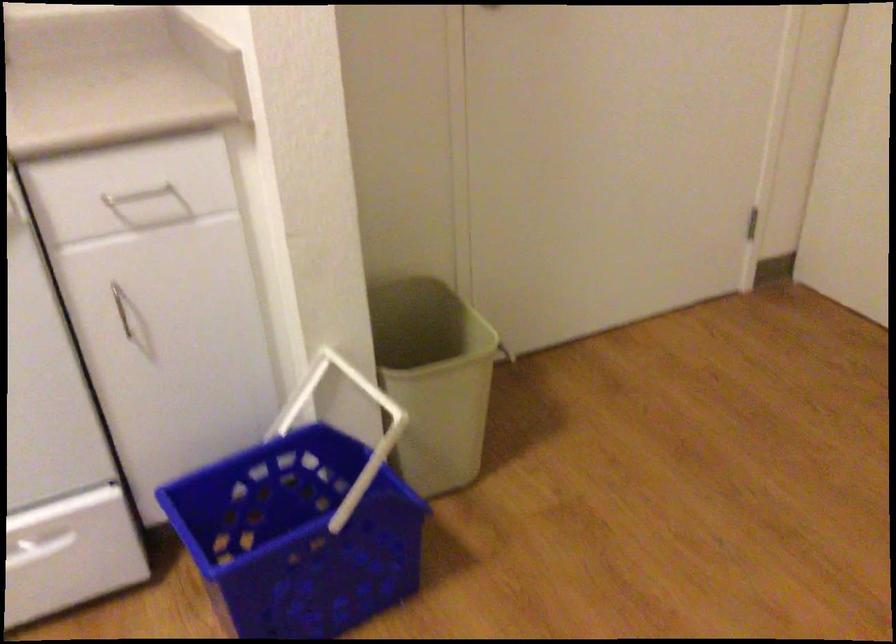
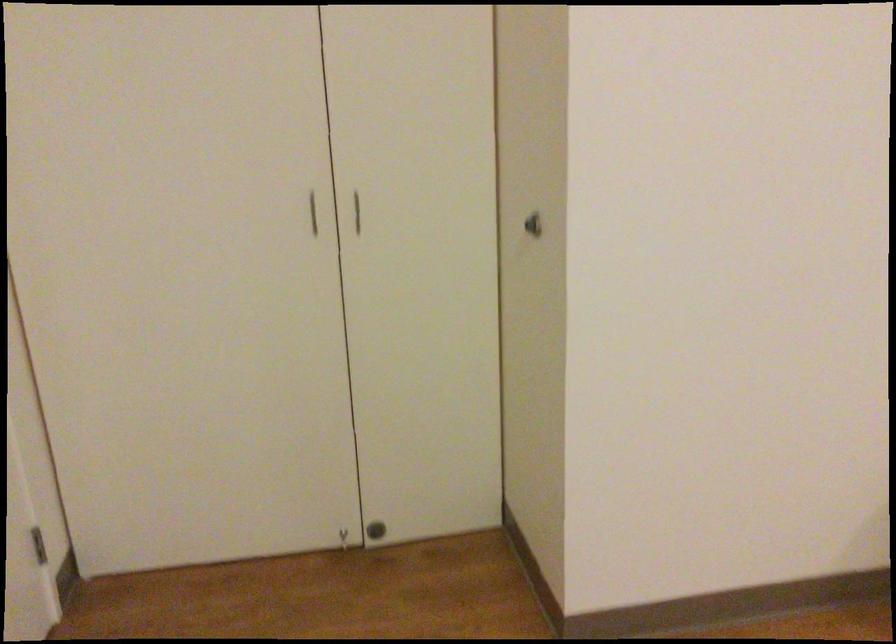
Question: The first image is from the beginning of the video and the second image is from the end. How did the camera likely rotate when shooting the video?

Choices:
 (A) Left
 (B) Right
 (C) Up
 (D) Down

Answer: (B)